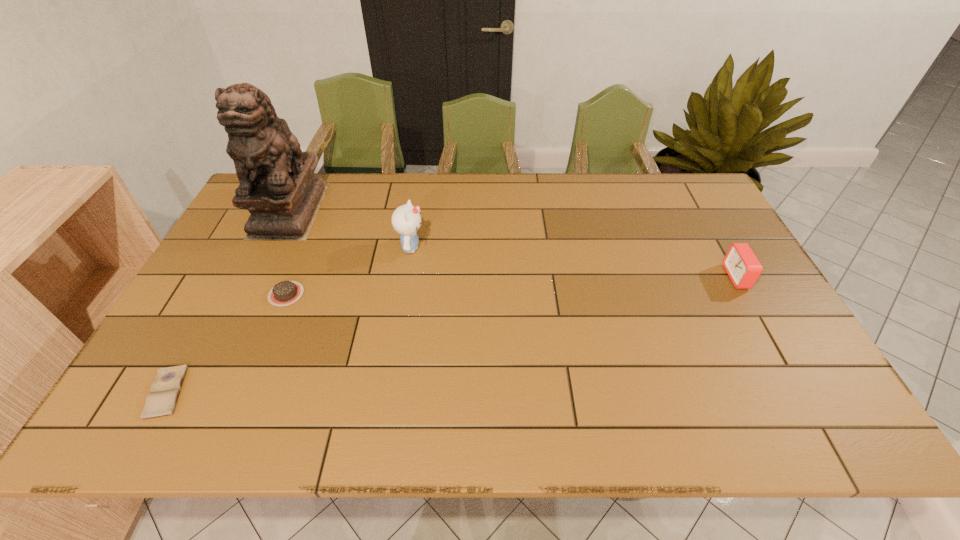
The width and height of the screenshot is (960, 540). Find the location of `the tallest object`. the tallest object is located at coordinates (277, 186).

Where is `the fourth object from left to right`? The image size is (960, 540). the fourth object from left to right is located at coordinates 406,219.

Image resolution: width=960 pixels, height=540 pixels. I want to click on the fourth shortest object, so click(x=406, y=219).

Find the location of a particular element. This screenshot has width=960, height=540. the third tallest object is located at coordinates (742, 266).

Find the location of a particular element. alarm clock is located at coordinates (742, 266).

Locate an element on the screen. The width and height of the screenshot is (960, 540). chocolate cake is located at coordinates (284, 293).

Locate an element on the screen. This screenshot has width=960, height=540. diary is located at coordinates (161, 401).

Find the location of a particular element. The width and height of the screenshot is (960, 540). the nearest object is located at coordinates (161, 401).

The image size is (960, 540). I want to click on vacant space situated 0.160m on the front-facing side of the sculpture, so click(256, 279).

Image resolution: width=960 pixels, height=540 pixels. Identify the location of free space located 0.110m on the front-facing side of the kitten. (463, 247).